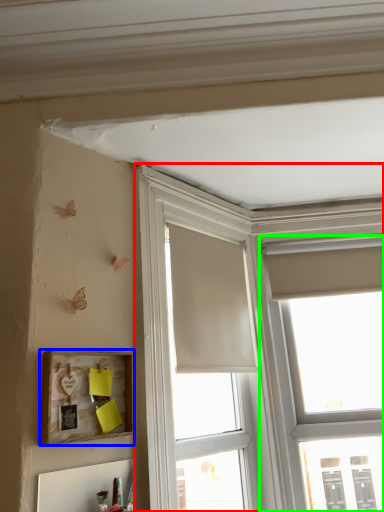
Question: Based on their relative distances, which object is farther from window (highlighted by a red box)? Choose from picture frame (highlighted by a blue box) and window (highlighted by a green box).

Choices:
 (A) picture frame
 (B) window

Answer: (A)